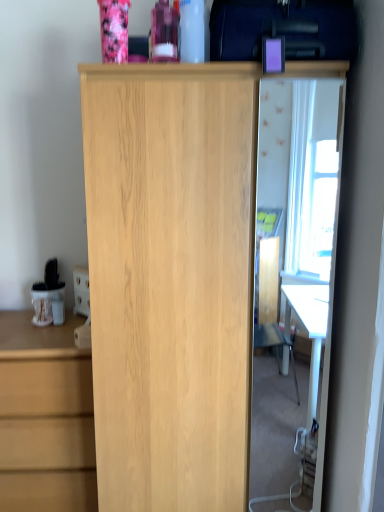
Question: Is transparent glass door at center shorter than light wood cupboard at center?

Choices:
 (A) no
 (B) yes

Answer: (B)

Question: From a real-world perspective, is transparent glass door at center positioned over light wood cupboard at center based on gravity?

Choices:
 (A) no
 (B) yes

Answer: (B)

Question: Are transparent glass door at center and light wood cupboard at center far apart?

Choices:
 (A) no
 (B) yes

Answer: (B)

Question: From the image's perspective, is transparent glass door at center located beneath light wood cupboard at center?

Choices:
 (A) yes
 (B) no

Answer: (B)

Question: From a real-world perspective, is transparent glass door at center positioned under light wood cupboard at center based on gravity?

Choices:
 (A) no
 (B) yes

Answer: (A)

Question: Is transparent glass door at center to the left of light wood cupboard at center from the viewer's perspective?

Choices:
 (A) yes
 (B) no

Answer: (B)

Question: From a real-world perspective, does light wood cupboard at center sit lower than purple plastic case at upper right?

Choices:
 (A) no
 (B) yes

Answer: (B)

Question: Is light wood cupboard at center located outside purple plastic case at upper right?

Choices:
 (A) no
 (B) yes

Answer: (B)

Question: Considering the relative positions of light wood cupboard at center and purple plastic case at upper right in the image provided, is light wood cupboard at center to the left of purple plastic case at upper right from the viewer's perspective?

Choices:
 (A) no
 (B) yes

Answer: (B)

Question: From the image's perspective, is light wood cupboard at center on purple plastic case at upper right?

Choices:
 (A) yes
 (B) no

Answer: (B)

Question: Considering the relative sizes of light wood cupboard at center and purple plastic case at upper right in the image provided, is light wood cupboard at center taller than purple plastic case at upper right?

Choices:
 (A) no
 (B) yes

Answer: (B)

Question: Does light wood cupboard at center have a lesser height compared to purple plastic case at upper right?

Choices:
 (A) no
 (B) yes

Answer: (A)

Question: Is light wood chest of drawers at left taller than purple plastic case at upper right?

Choices:
 (A) yes
 (B) no

Answer: (A)